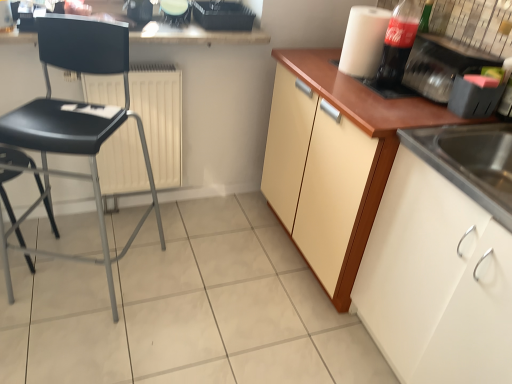
This screenshot has width=512, height=384. What are the coordinates of `free location to the right of black plastic chair at left, the first chair viewed from the left` in the screenshot? It's located at (76, 254).